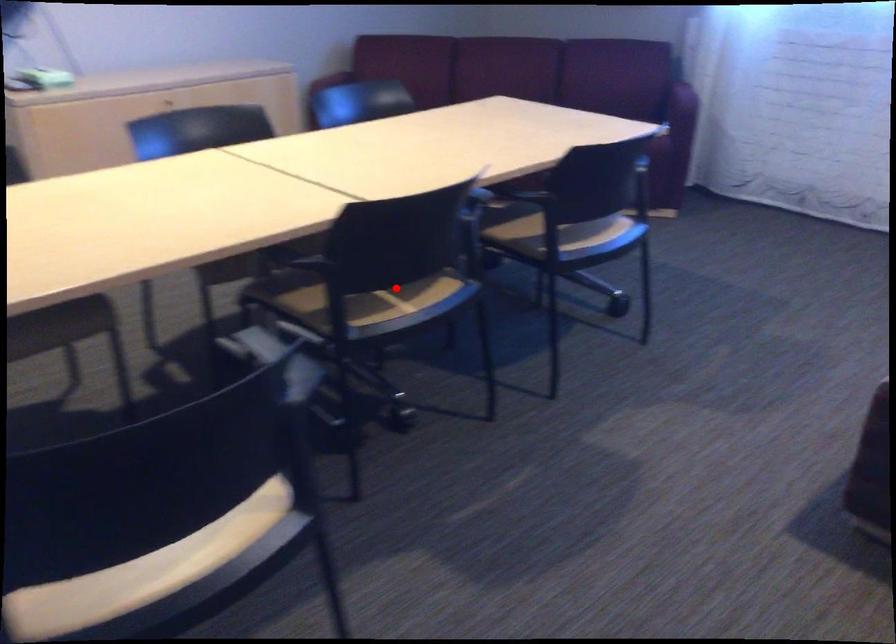
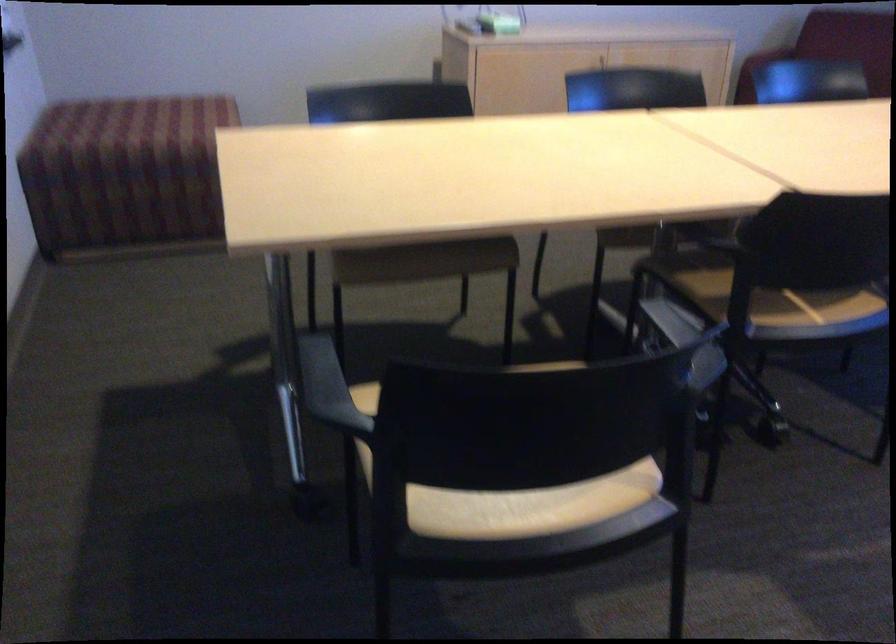
Question: A red point is marked in image1. In image2, is the corresponding 3D point closer to the camera or farther? Reply with the corresponding letter.

Choices:
 (A) The corresponding 3D point is closer.
 (B) The corresponding 3D point is farther.

Answer: (A)